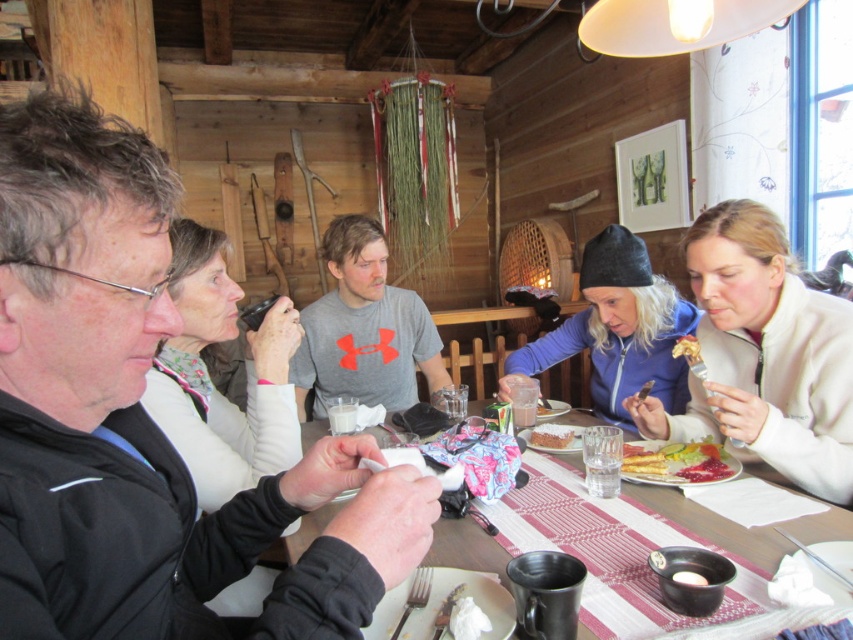
Question: Which of the following is the closest to the observer?

Choices:
 (A) matte black plate at center
 (B) white fleece jacket at right
 (C) blue fleece jacket at upper right
 (D) white fabric at upper left

Answer: (A)

Question: Does matte black plate at center appear on the right side of golden crispy pastry at center?

Choices:
 (A) yes
 (B) no

Answer: (B)

Question: Which object appears farthest from the camera in this image?

Choices:
 (A) white fabric at upper left
 (B) smooth white plate at center

Answer: (B)

Question: Can you confirm if pink glossy jam at lower right is bigger than golden crispy pastry at center?

Choices:
 (A) yes
 (B) no

Answer: (B)

Question: From the image, what is the correct spatial relationship of black matte jacket at left in relation to golden crispy pancake at lower right?

Choices:
 (A) right
 (B) left

Answer: (B)

Question: Which point is farther to the camera?

Choices:
 (A) white fabric at upper left
 (B) matte black plate at center
 (C) gray matte t-shirt at center

Answer: (C)